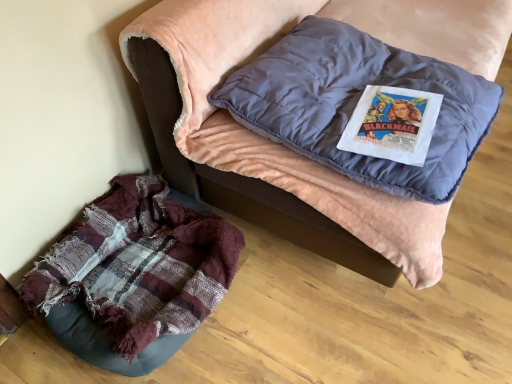
Find the location of a particular element. The width and height of the screenshot is (512, 384). plaid fabric cushion at lower left is located at coordinates [x=290, y=150].

At what (x,y) coordinates should I click in order to perform the action: click on worn fabric bean bag at lower left. Please return your answer as a coordinate pair (x, y). The height and width of the screenshot is (384, 512). Looking at the image, I should click on [134, 276].

Identify the location of plaid fabric cushion at lower left. The width and height of the screenshot is (512, 384). (290, 150).

Looking at this image, in the image, is plaid fabric cushion at lower left on the left side or the right side of matte blue pillow at upper center?

Based on their positions, plaid fabric cushion at lower left is located to the right of matte blue pillow at upper center.

From a real-world perspective, which is physically above, plaid fabric cushion at lower left or matte blue pillow at upper center?

matte blue pillow at upper center, from a real-world perspective.

This screenshot has height=384, width=512. In order to click on pillow behind the plaid fabric cushion at lower left in this screenshot , I will do `click(356, 103)`.

From the image's perspective, is plaid fabric cushion at lower left located above or below matte blue pillow at upper center?

From the image's perspective, plaid fabric cushion at lower left appears above matte blue pillow at upper center.

Measure the distance between plaid fabric cushion at lower left and worn fabric bean bag at lower left.

plaid fabric cushion at lower left is 19.50 inches away from worn fabric bean bag at lower left.

From a real-world perspective, is plaid fabric cushion at lower left located higher than worn fabric bean bag at lower left?

Yes, from a real-world perspective, plaid fabric cushion at lower left is above worn fabric bean bag at lower left.

Can you confirm if plaid fabric cushion at lower left is positioned to the left of worn fabric bean bag at lower left?

No.

Which is closer to the camera, (392, 206) or (64, 256)?

Point (392, 206) appears to be closer to the viewer than point (64, 256).

Is worn fabric bean bag at lower left to the right of plaid fabric cushion at lower left from the viewer's perspective?

Incorrect, worn fabric bean bag at lower left is not on the right side of plaid fabric cushion at lower left.

Would you consider worn fabric bean bag at lower left to be distant from plaid fabric cushion at lower left?

They are positioned close to each other.

Does worn fabric bean bag at lower left have a lesser width compared to plaid fabric cushion at lower left?

Yes.

Which object is wider, matte blue pillow at upper center or worn fabric bean bag at lower left?

With larger width is matte blue pillow at upper center.

Between matte blue pillow at upper center and worn fabric bean bag at lower left, which one is positioned in front?

Positioned in front is matte blue pillow at upper center.

Is point (352, 106) positioned after point (199, 291)?

No, it is in front of (199, 291).

Can you see matte blue pillow at upper center touching worn fabric bean bag at lower left?

No.

Is worn fabric bean bag at lower left not near matte blue pillow at upper center?

They are positioned close to each other.

Identify the location of bean bag chair that is below the matte blue pillow at upper center (from the image's perspective). (134, 276).

Considering the relative positions of worn fabric bean bag at lower left and matte blue pillow at upper center in the image provided, is worn fabric bean bag at lower left to the right of matte blue pillow at upper center from the viewer's perspective?

No, worn fabric bean bag at lower left is not to the right of matte blue pillow at upper center.

Can you tell me how much worn fabric bean bag at lower left and matte blue pillow at upper center differ in facing direction?

2.85 degrees.

From the image's perspective, between matte blue pillow at upper center and plaid fabric cushion at lower left, which one is located above?

plaid fabric cushion at lower left is shown above in the image.

Is matte blue pillow at upper center facing towards plaid fabric cushion at lower left?

Yes.

In the scene shown: Does matte blue pillow at upper center touch plaid fabric cushion at lower left?

No, matte blue pillow at upper center is not with plaid fabric cushion at lower left.

From a real-world perspective, between matte blue pillow at upper center and plaid fabric cushion at lower left, who is vertically lower?

plaid fabric cushion at lower left is physically lower.

At what (x,y) coordinates should I click in order to perform the action: click on pillow below the plaid fabric cushion at lower left (from the image's perspective). Please return your answer as a coordinate pair (x, y). Looking at the image, I should click on (356, 103).

Locate an element on the screen. bean bag chair located on the left of plaid fabric cushion at lower left is located at coordinates (134, 276).

When comparing their distances from matte blue pillow at upper center, does worn fabric bean bag at lower left or plaid fabric cushion at lower left seem closer?

Based on the image, plaid fabric cushion at lower left appears to be nearer to matte blue pillow at upper center.

Estimate the real-world distances between objects in this image. Which object is closer to worn fabric bean bag at lower left, plaid fabric cushion at lower left or matte blue pillow at upper center?

plaid fabric cushion at lower left.

Based on their spatial positions, is worn fabric bean bag at lower left or matte blue pillow at upper center further from plaid fabric cushion at lower left?

The object further to plaid fabric cushion at lower left is worn fabric bean bag at lower left.

Which object lies further to the anchor point plaid fabric cushion at lower left, matte blue pillow at upper center or worn fabric bean bag at lower left?

The object further to plaid fabric cushion at lower left is worn fabric bean bag at lower left.

Looking at this image, considering their positions, is matte blue pillow at upper center positioned closer to worn fabric bean bag at lower left than plaid fabric cushion at lower left?

Based on the image, plaid fabric cushion at lower left appears to be nearer to worn fabric bean bag at lower left.

In the scene shown: Based on their spatial positions, is plaid fabric cushion at lower left or worn fabric bean bag at lower left closer to matte blue pillow at upper center?

Among the two, plaid fabric cushion at lower left is located nearer to matte blue pillow at upper center.

Locate an element on the screen. The width and height of the screenshot is (512, 384). pillow between worn fabric bean bag at lower left and plaid fabric cushion at lower left from left to right is located at coordinates (356, 103).